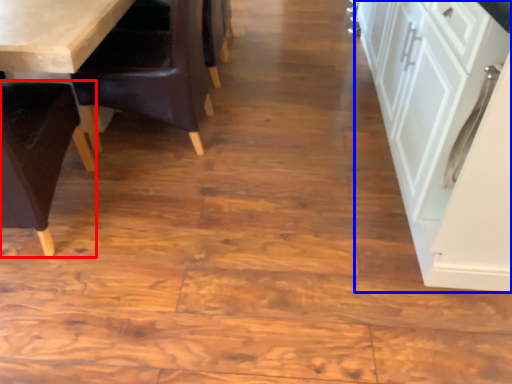
Question: Which object is closer to the camera taking this photo, chair (highlighted by a red box) or cabinetry (highlighted by a blue box)?

Choices:
 (A) chair
 (B) cabinetry

Answer: (B)